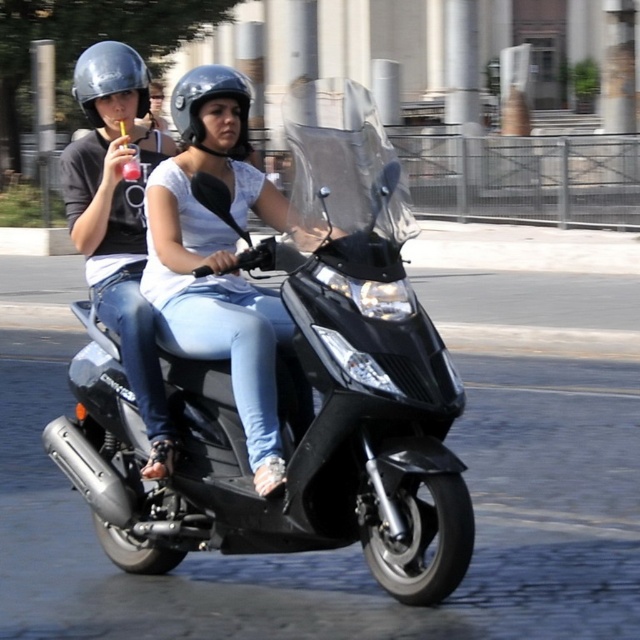
You are a pedestrian on the sidewalk and see the matte black helmet at upper left and the shiny silver helmet at upper left. Which helmet is closer to the center of the image?

The matte black helmet at upper left is closer to the center of the image because it is positioned to the right of the shiny silver helmet at upper left.

You are a delivery person who needs to choose a helmet that takes up less space in your delivery bag. You see the matte black helmet at center and the shiny silver helmet at upper left in the image. Which helmet should you choose?

The matte black helmet at center occupies less space than the shiny silver helmet at upper left, so you should choose the matte black helmet at center.

You are a pedestrian standing on the sidewalk. You see the black matte scooter at center and the shiny silver helmet at upper left. Which object is closer to the ground?

The black matte scooter at center is closer to the ground because it is positioned below the shiny silver helmet at upper left.